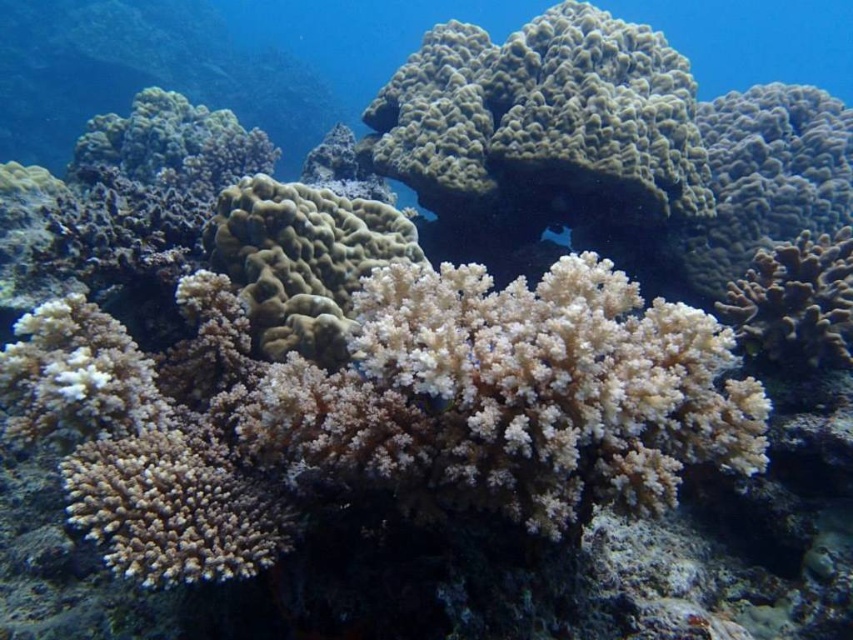
Is white soft coral at center below white soft coral at right?

A: Incorrect, white soft coral at center is not positioned below white soft coral at right.

This screenshot has height=640, width=853. Describe the element at coordinates (302, 260) in the screenshot. I see `white soft coral at center` at that location.

What do you see at coordinates (302, 260) in the screenshot? I see `white soft coral at center` at bounding box center [302, 260].

At what (x,y) coordinates should I click in order to perform the action: click on white soft coral at center. Please return your answer as a coordinate pair (x, y). The image size is (853, 640). Looking at the image, I should click on (302, 260).